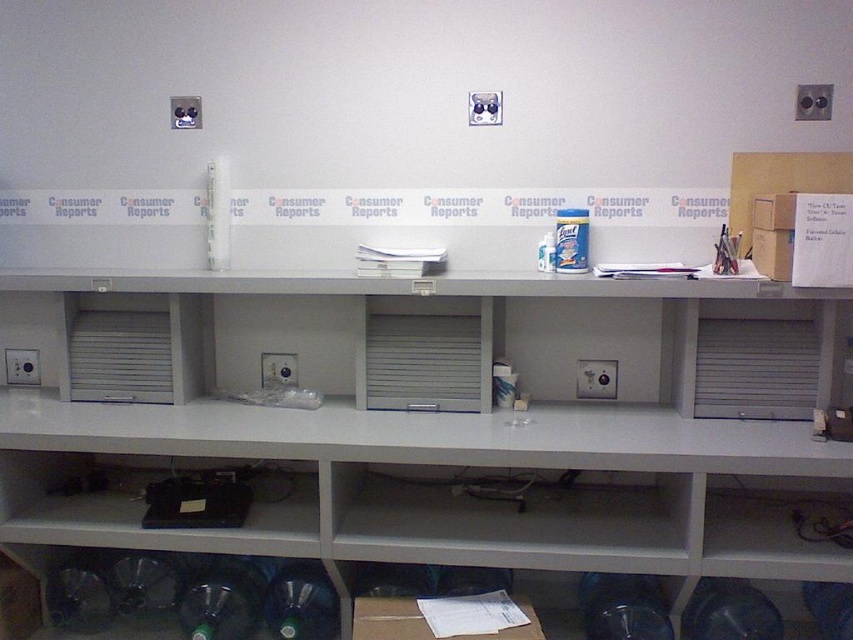
You are organizing supplies in the laboratory. You have a large box that needs to be placed on either the white glossy counter at center or the white matte shelf at lower center. Based on their sizes, which surface can accommodate the large box more appropriately?

The white glossy counter at center has a larger size compared to the white matte shelf at lower center, so it can accommodate the large box more appropriately.

You are a delivery person who just arrived at the laboratory. You need to place a new item on the shelf. The instructions say to place it at the point that is closer to the wall. Which point should you choose between point (10, 465) and point (733, 477)?

Point (733, 477) is farther from the viewer than point (10, 465), so it is closer to the wall. Therefore, you should place the item at point (733, 477).